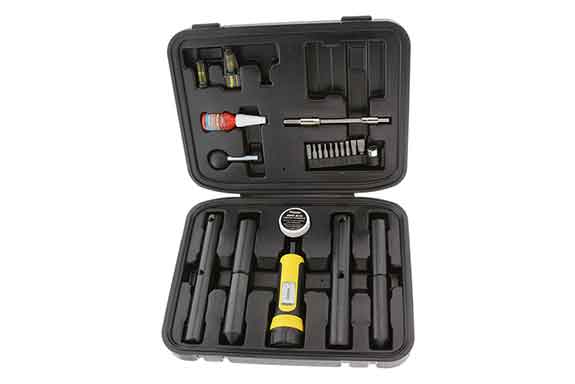
The width and height of the screenshot is (575, 384). I want to click on plastic box, so click(288, 154).